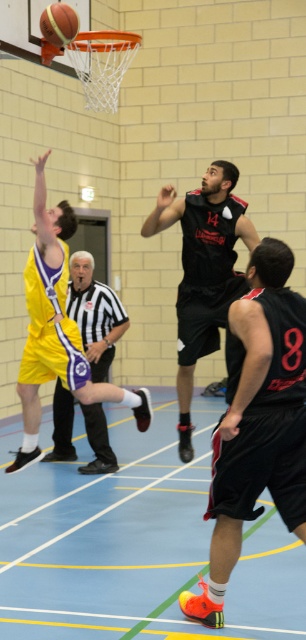
You are a referee watching the basketball game. You notice the yellow jersey at left and the rubber textured basketball at center. Which object is positioned lower in the image?

The yellow jersey at left is located below the rubber textured basketball at center, so the yellow jersey at left is positioned lower in the image.